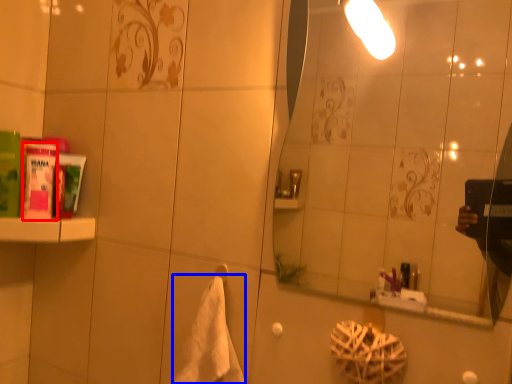
Question: Which object is closer to the camera taking this photo, mouthwash (highlighted by a red box) or bath towel (highlighted by a blue box)?

Choices:
 (A) mouthwash
 (B) bath towel

Answer: (B)